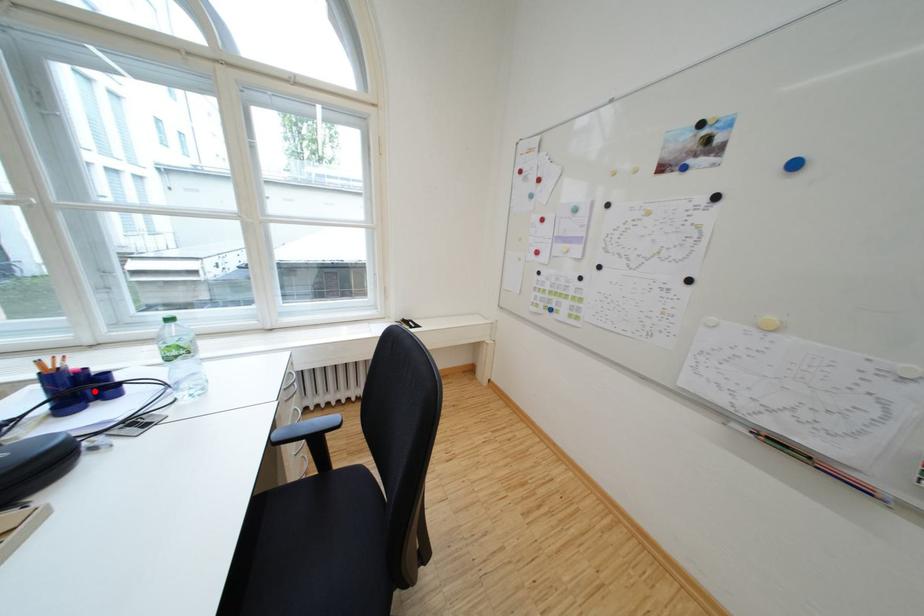
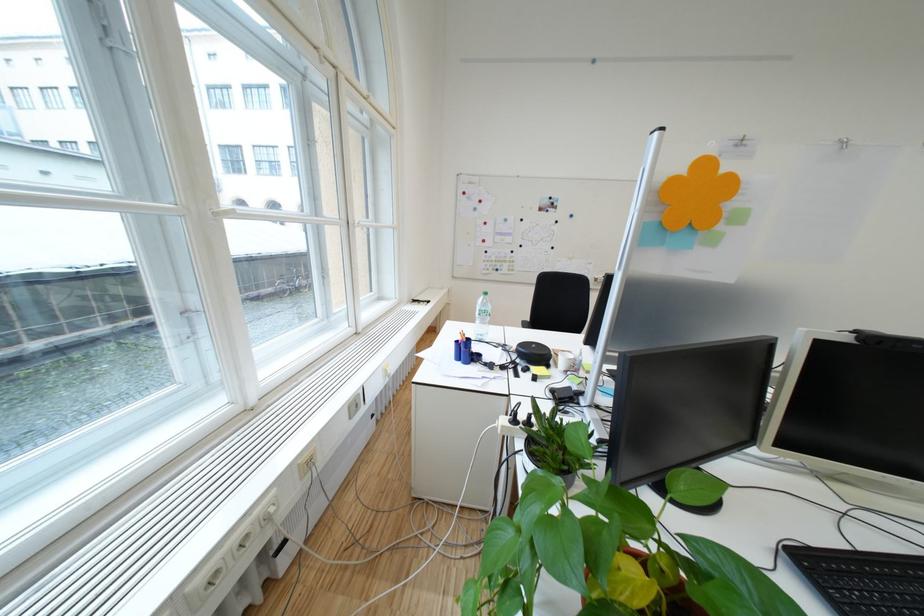
Question: I am providing you with two images of the same scene from different viewpoints. A red point is marked on the first image. Can you still see the location of the red point in image 2?

Choices:
 (A) Yes
 (B) No

Answer: (B)